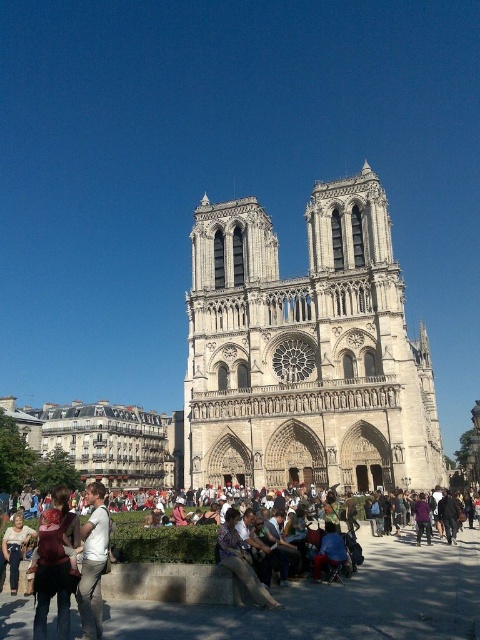
Question: In this image, where is denim jacket at lower center located relative to leather jacket at center?

Choices:
 (A) left
 (B) right

Answer: (B)

Question: In this image, where is stone gothic cathedral at center located relative to denim jacket at lower center?

Choices:
 (A) left
 (B) right

Answer: (B)

Question: Considering the real-world distances, which object is farthest from the stone gothic cathedral at center?

Choices:
 (A) denim jacket at lower center
 (B) white cotton shirt at lower left
 (C) leather jacket at center

Answer: (B)

Question: Which point is closer to the camera?

Choices:
 (A) stone gothic cathedral at center
 (B) denim jacket at lower center
 (C) leather jacket at center

Answer: (B)

Question: Can you confirm if stone gothic cathedral at center is smaller than white cotton shirt at lower left?

Choices:
 (A) no
 (B) yes

Answer: (A)

Question: Among these objects, which one is farthest from the camera?

Choices:
 (A) denim jacket at lower center
 (B) white cotton shirt at lower left

Answer: (B)